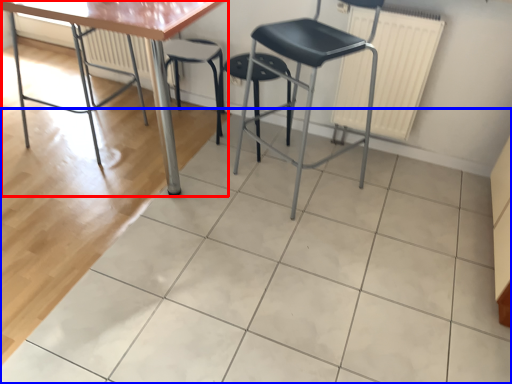
Question: Which object appears closest to the camera in this image, table (highlighted by a red box) or ceramic tile (highlighted by a blue box)?

Choices:
 (A) table
 (B) ceramic tile

Answer: (B)